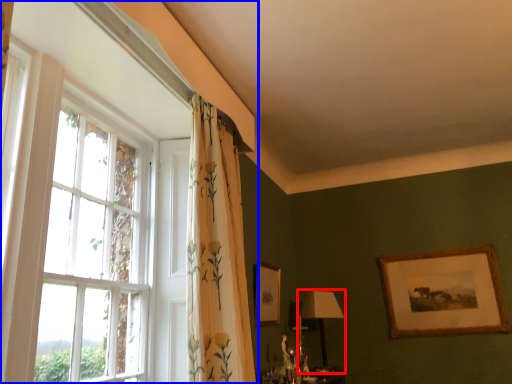
Question: Among these objects, which one is farthest to the camera, table lamp (highlighted by a red box) or window (highlighted by a blue box)?

Choices:
 (A) table lamp
 (B) window

Answer: (A)